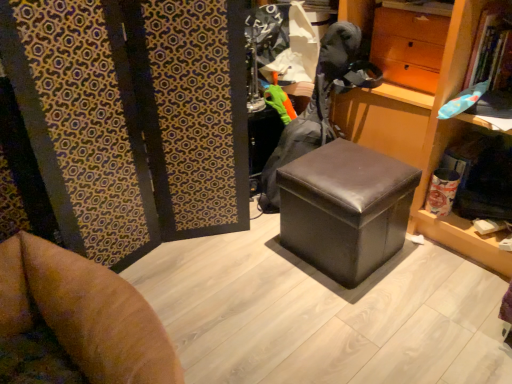
Find the location of a particular element. The height and width of the screenshot is (384, 512). vacant point above black leather ottoman at center (from a real-world perspective) is located at coordinates (336, 169).